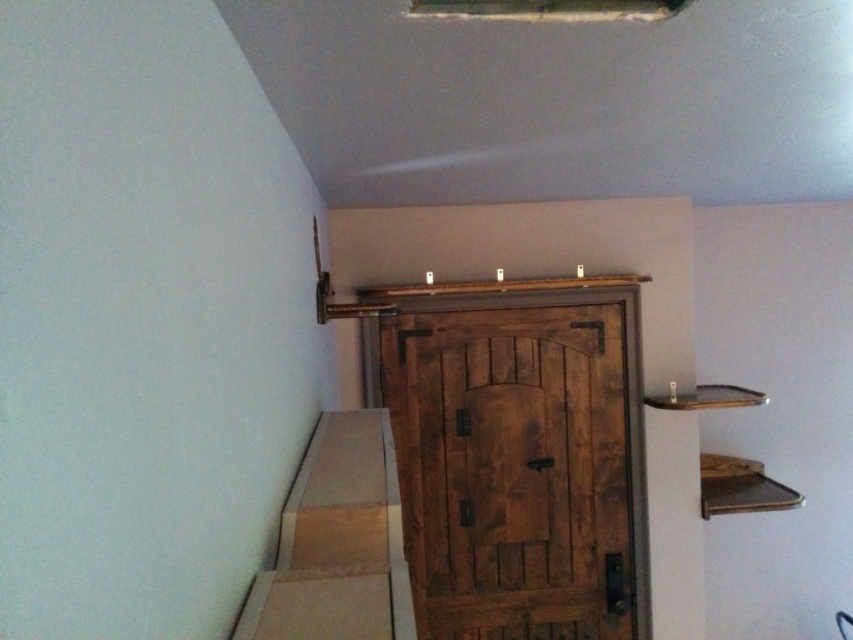
Question: Where is rustic wood door at center located in relation to wooden stairs at lower center in the image?

Choices:
 (A) above
 (B) below

Answer: (B)

Question: Can you confirm if rustic wood door at center is positioned to the right of wooden stairs at lower center?

Choices:
 (A) yes
 (B) no

Answer: (A)

Question: Which object appears closest to the camera in this image?

Choices:
 (A) wooden stairs at lower center
 (B) rustic wood door at center

Answer: (A)

Question: Among these points, which one is nearest to the camera?

Choices:
 (A) (367, 483)
 (B) (447, 346)

Answer: (A)

Question: Is rustic wood door at center further to the viewer compared to wooden stairs at lower center?

Choices:
 (A) no
 (B) yes

Answer: (B)